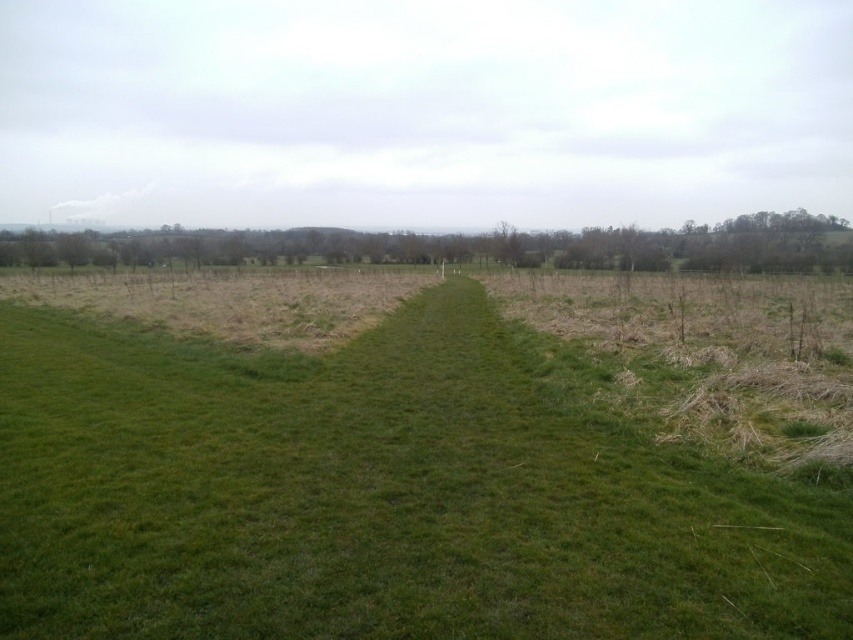
You are standing at the edge of the green grassy field at left and want to walk towards the green grassy path at center. Which direction should you move to reach the path?

The green grassy path at center is positioned on the left side of the green grassy field at left, so you should move to the left to reach the path.

You are planning to walk from the green grassy field at left to the green grassy path at center. Which area will you be stepping into first?

The green grassy field at left is the area you are starting from, so you will first step into the green grassy path at center as you move towards it.